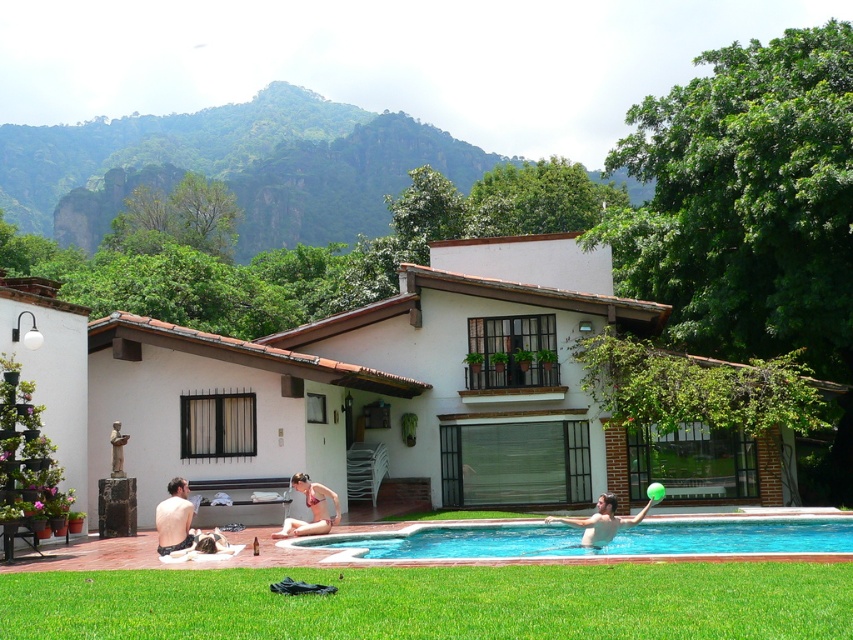
Between blue glossy water at lower center and beige bikini at lower center, which one has more height?

blue glossy water at lower center

Is blue glossy water at lower center smaller than beige bikini at lower center?

No, blue glossy water at lower center is not smaller than beige bikini at lower center.

Image resolution: width=853 pixels, height=640 pixels. Describe the element at coordinates (595, 547) in the screenshot. I see `blue glossy water at lower center` at that location.

The image size is (853, 640). In order to click on blue glossy water at lower center in this screenshot , I will do `click(595, 547)`.

Who is more distant from viewer, [163,356] or [165,509]?

Positioned behind is point [163,356].

Does white stucco villa at center have a lesser width compared to shiny black swimwear at lower left?

Incorrect, white stucco villa at center's width is not less than shiny black swimwear at lower left's.

Which is behind, point (408, 400) or point (177, 516)?

Positioned behind is point (408, 400).

Locate an element on the screen. white stucco villa at center is located at coordinates (416, 394).

Is point (570, 259) behind point (482, 556)?

Yes, it is.

Looking at this image, between white stucco villa at center and blue glossy water at lower center, which one has more height?

white stucco villa at center is taller.

Between point (119, 394) and point (776, 528), which one is positioned in front?

Point (776, 528) is in front.

I want to click on white stucco villa at center, so click(x=416, y=394).